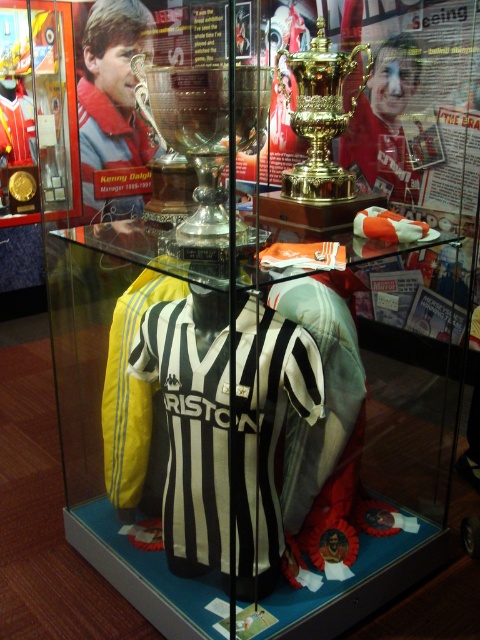
You are a museum guide explaining the display case. A visitor asks which trophy is bigger between the silver polished trophy at center and the gold polished trophy at upper center. What do you tell them?

The silver polished trophy at center is larger in size compared to the gold polished trophy at upper center.

You are standing in front of the display case and want to touch the point at coordinates point (264,384). If your hand can reach up to 1.2 meters, can you reach it?

The distance between you and point (264,384) is 1.36 meters, which is beyond your hand reach of 1.2 meters. Therefore, you cannot reach it.

You are a curator planning to install a new light fixture in the display case. The light must be positioned at point (192,136). What object will the light directly illuminate?

The light positioned at point (192,136) will directly illuminate the silver polished trophy at center since the point is located on it according to the coordinates provided.